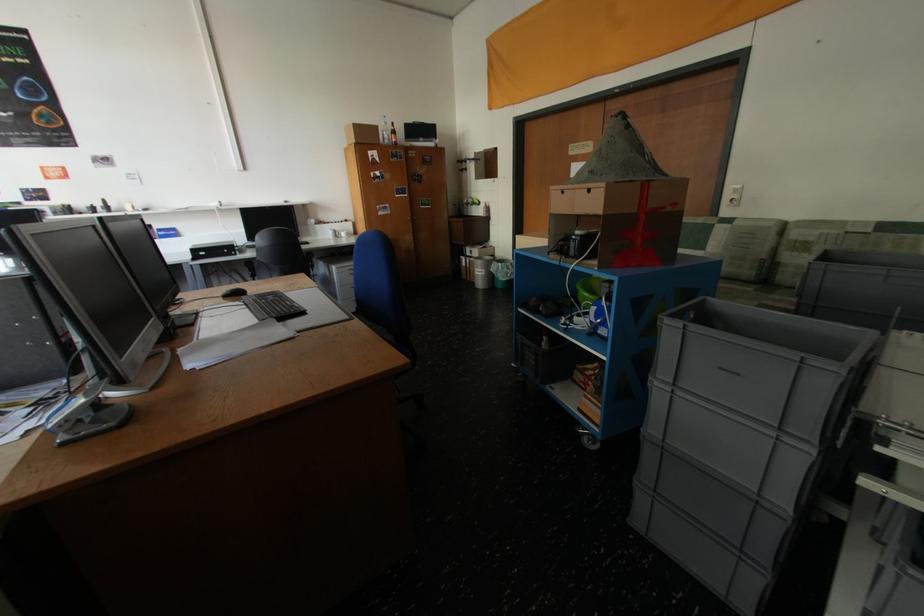
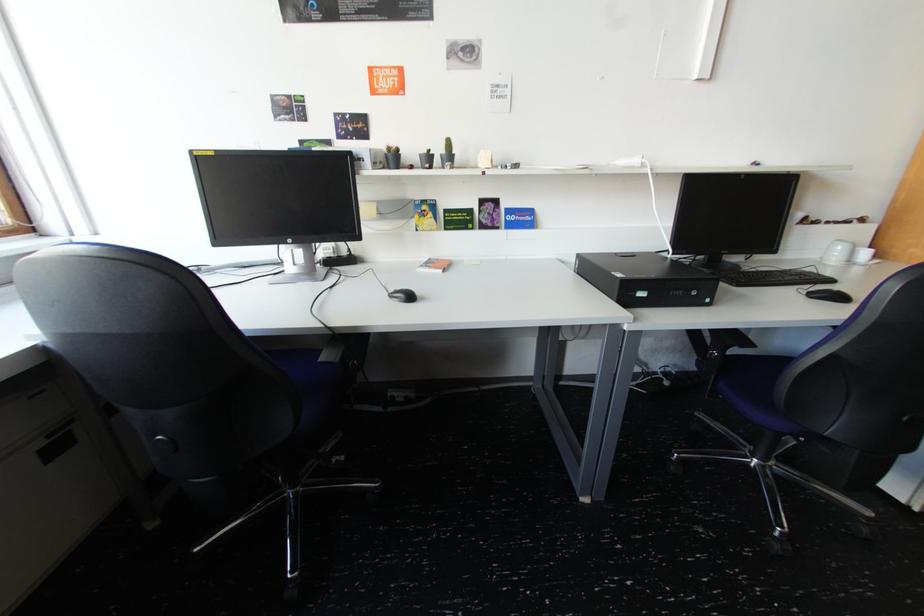
Where in the second image is the point corresponding to pixel 339 233 from the first image?

(849, 249)